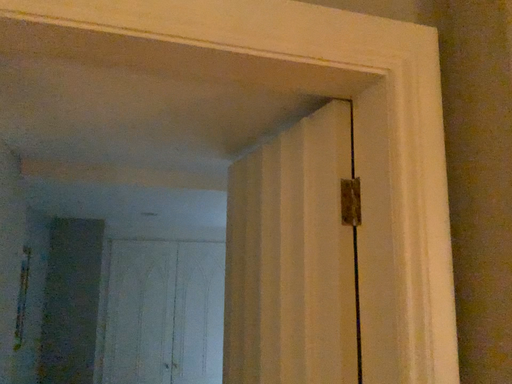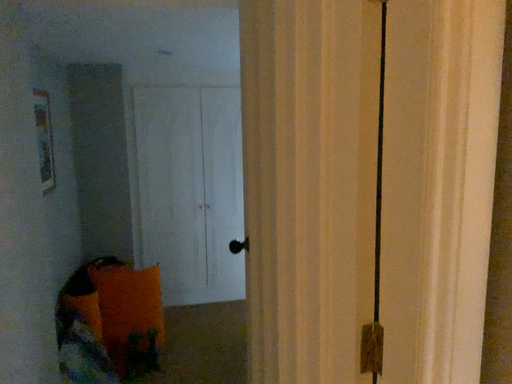
Question: How did the camera likely rotate when shooting the video?

Choices:
 (A) rotated upward
 (B) rotated downward

Answer: (B)